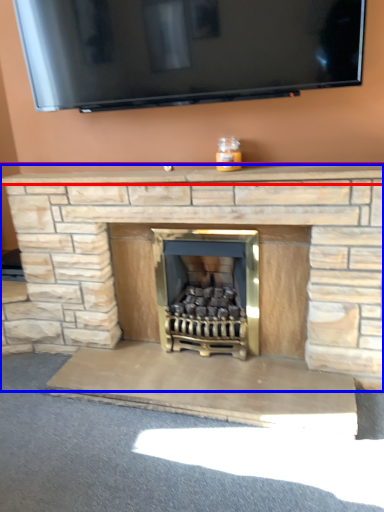
Question: Which object is further to the camera taking this photo, mantle (highlighted by a red box) or fireplace (highlighted by a blue box)?

Choices:
 (A) mantle
 (B) fireplace

Answer: (A)